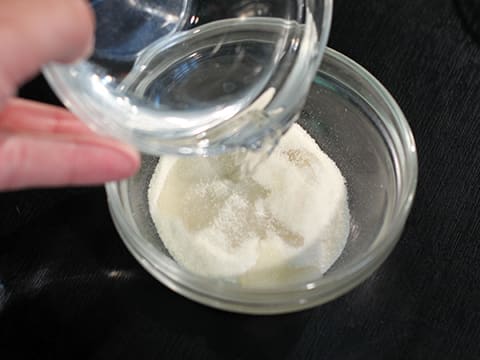
Where is `clear small bowls`? Image resolution: width=480 pixels, height=360 pixels. clear small bowls is located at coordinates (355, 160), (315, 11).